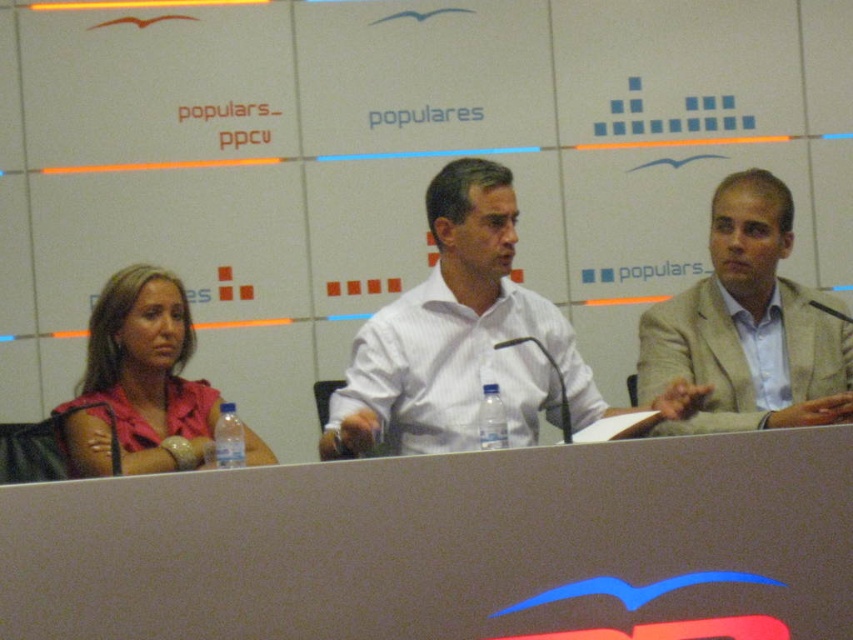
Question: Is white striped shirt at center smaller than light beige suit at right?

Choices:
 (A) yes
 (B) no

Answer: (B)

Question: Which object is closer to the camera taking this photo?

Choices:
 (A) pink fabric shirt at left
 (B) light beige suit at right

Answer: (A)

Question: Can you confirm if white striped shirt at center is positioned above pink fabric shirt at left?

Choices:
 (A) no
 (B) yes

Answer: (B)

Question: Is white striped shirt at center smaller than pink fabric shirt at left?

Choices:
 (A) no
 (B) yes

Answer: (A)

Question: Which point is farther from the camera taking this photo?

Choices:
 (A) (164, 413)
 (B) (525, 310)

Answer: (B)

Question: Which point appears closest to the camera in this image?

Choices:
 (A) (502, 257)
 (B) (753, 422)

Answer: (B)